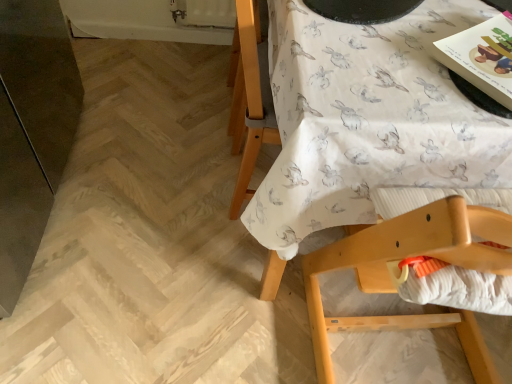
Where is `free region on the left part of matte paper magazine at upper right`? The image size is (512, 384). free region on the left part of matte paper magazine at upper right is located at coordinates (401, 65).